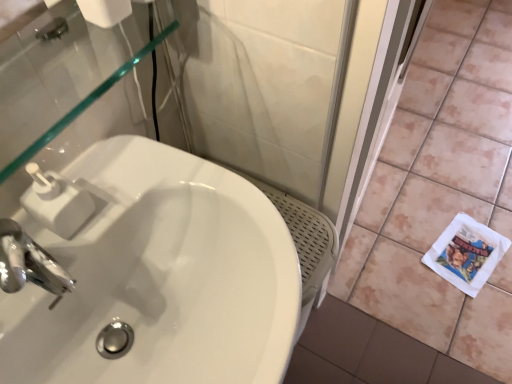
Question: Is white matte toilet paper at upper left at the right side of white ceramic tile at lower right?

Choices:
 (A) yes
 (B) no

Answer: (B)

Question: From a real-world perspective, does white matte toilet paper at upper left stand above white ceramic tile at lower right?

Choices:
 (A) yes
 (B) no

Answer: (A)

Question: Does white matte toilet paper at upper left lie behind white ceramic tile at lower right?

Choices:
 (A) yes
 (B) no

Answer: (B)

Question: Considering the relative sizes of white matte toilet paper at upper left and white ceramic tile at lower right in the image provided, is white matte toilet paper at upper left shorter than white ceramic tile at lower right?

Choices:
 (A) no
 (B) yes

Answer: (A)

Question: Is white matte toilet paper at upper left to the left of white ceramic tile at lower right from the viewer's perspective?

Choices:
 (A) no
 (B) yes

Answer: (B)

Question: Is white ceramic tile at lower right taller or shorter than white paper at lower right?

Choices:
 (A) short
 (B) tall

Answer: (B)

Question: Do you think white ceramic tile at lower right is within white paper at lower right, or outside of it?

Choices:
 (A) outside
 (B) inside

Answer: (A)

Question: Based on their positions, is white ceramic tile at lower right located to the left or right of white paper at lower right?

Choices:
 (A) right
 (B) left

Answer: (A)

Question: Looking at their shapes, would you say white ceramic tile at lower right is wider or thinner than white paper at lower right?

Choices:
 (A) thin
 (B) wide

Answer: (B)

Question: Is point (39, 178) closer or farther from the camera than point (459, 258)?

Choices:
 (A) closer
 (B) farther

Answer: (A)

Question: Is white plastic soap dispenser at upper left wider or thinner than white paper at lower right?

Choices:
 (A) thin
 (B) wide

Answer: (A)

Question: From a real-world perspective, is white plastic soap dispenser at upper left above or below white paper at lower right?

Choices:
 (A) above
 (B) below

Answer: (A)

Question: From the image's perspective, is white plastic soap dispenser at upper left located above or below white paper at lower right?

Choices:
 (A) above
 (B) below

Answer: (A)

Question: Does point (470, 248) appear closer or farther from the camera than point (2, 299)?

Choices:
 (A) closer
 (B) farther

Answer: (B)

Question: Considering the relative positions of white paper at lower right and white glossy sink at center in the image provided, is white paper at lower right to the left or to the right of white glossy sink at center?

Choices:
 (A) left
 (B) right

Answer: (B)